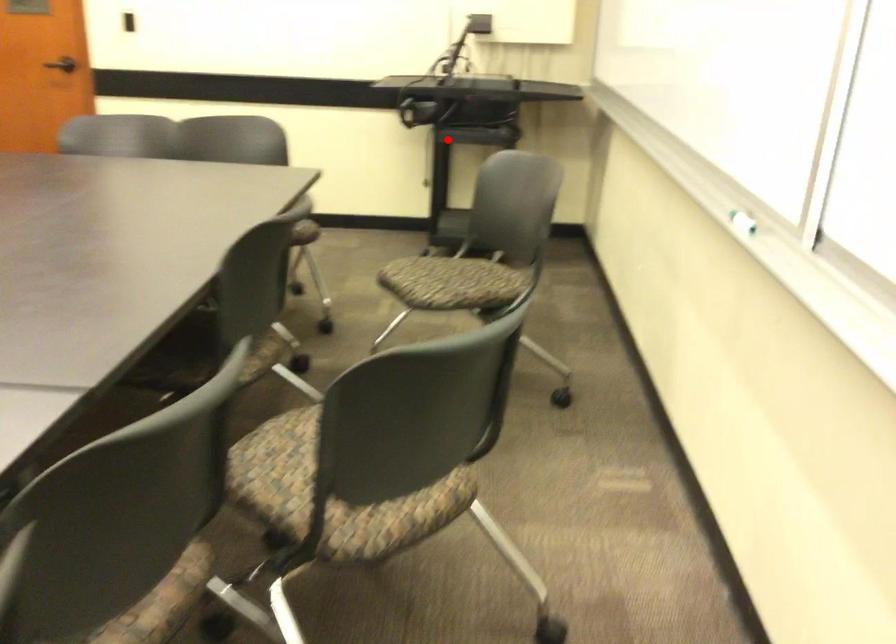
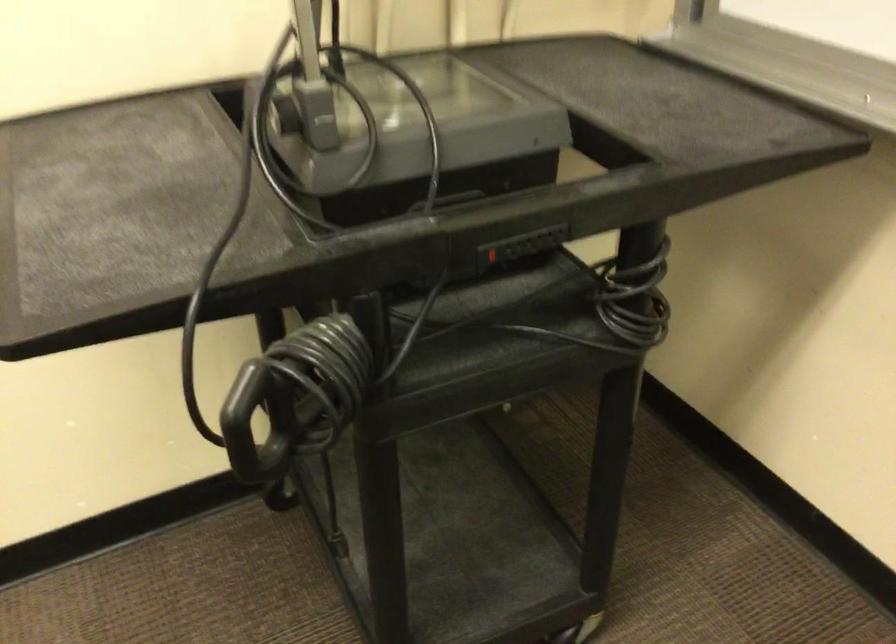
Locate, in the second image, the point that corresponds to the highlighted location in the first image.

(490, 254)